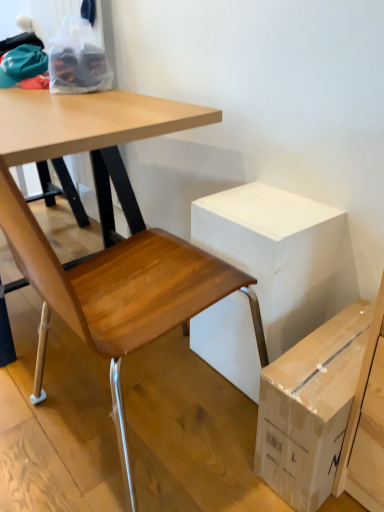
Where is `vacant area on top of white cardboard box at center (from a real-world perspective)`? This screenshot has width=384, height=512. vacant area on top of white cardboard box at center (from a real-world perspective) is located at coordinates (257, 202).